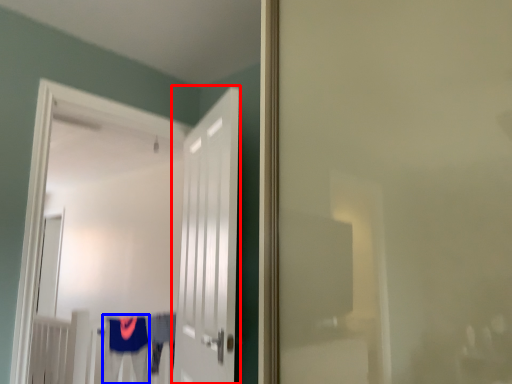
Question: Which object appears farthest to the camera in this image, door (highlighted by a red box) or robe (highlighted by a blue box)?

Choices:
 (A) door
 (B) robe

Answer: (B)